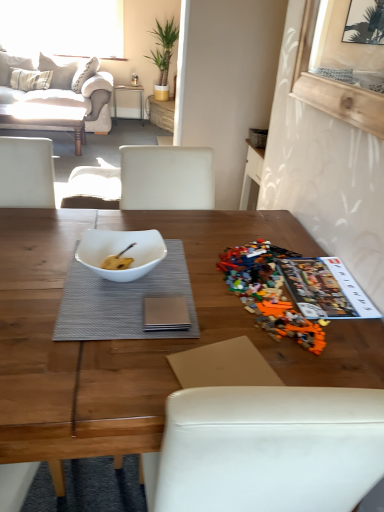
Find the location of a particular element. The image size is (384, 512). free space to the left of white glossy bowl at center is located at coordinates (42, 267).